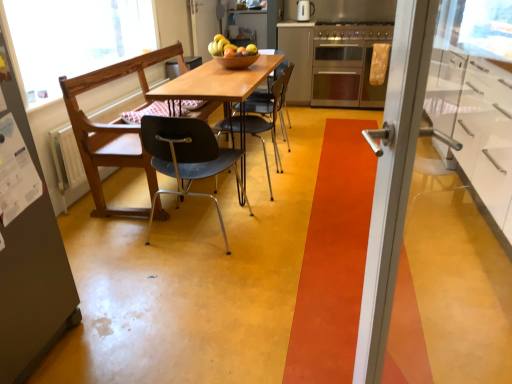
Locate an element on the screen. The height and width of the screenshot is (384, 512). vacant area that is in front of wooden table at center is located at coordinates click(x=278, y=252).